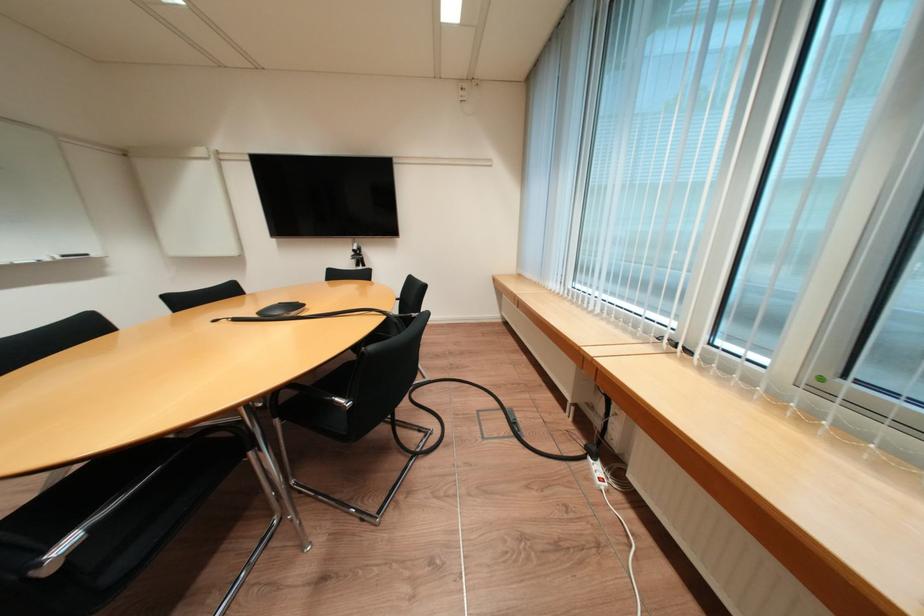
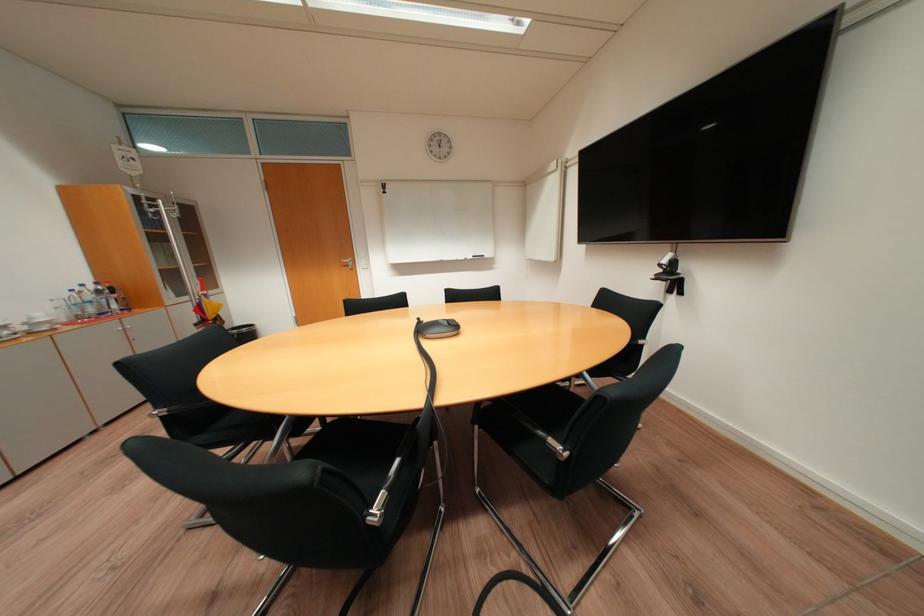
Question: I am providing you with two images of the same scene from different viewpoints. After the viewpoint changes to image2, which objects are now occluded?

Choices:
 (A) metal chair armrest
 (B) black webcam
 (C) silver cabinet handle
 (D) cylindrical toy container

Answer: (A)